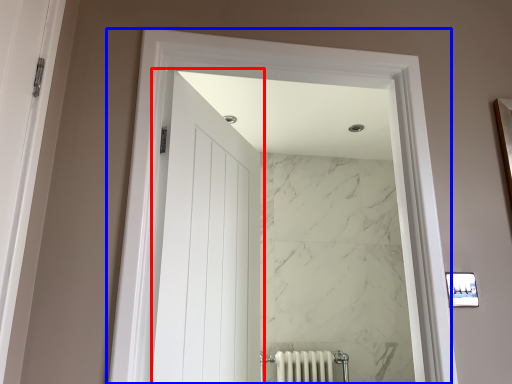
Question: Which point is closer to the camera, door (highlighted by a red box) or window (highlighted by a blue box)?

Choices:
 (A) door
 (B) window

Answer: (B)